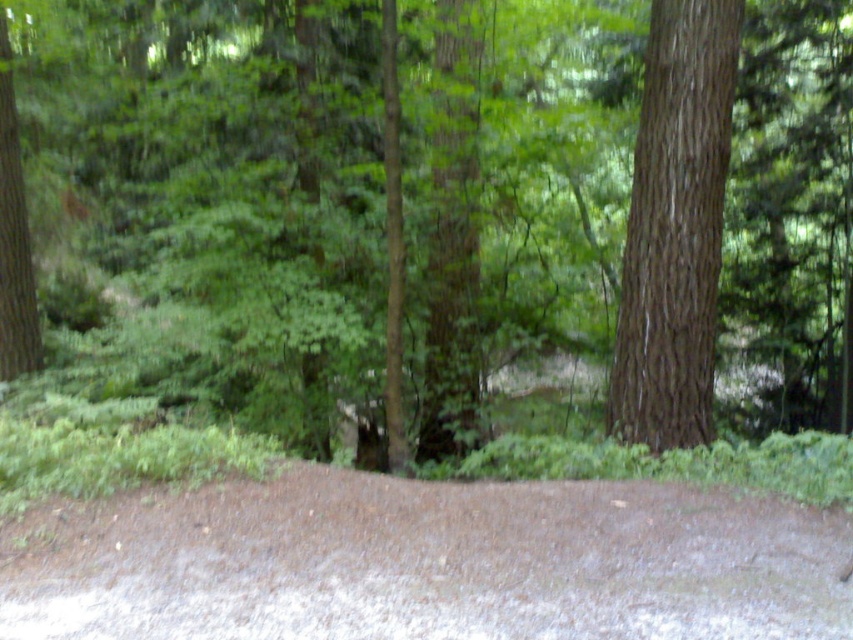
You are planning a hiking trip and want to know if the green leafy forest at center is wider than the brown dirt path at lower center. Can you confirm this based on the scene?

The green leafy forest at center is wider than the brown dirt path at lower center according to the description.

You are a photographer standing in the forest scene. You want to take a photo that includes both the point at coordinates point (x=177, y=515) and point (x=650, y=317). Which point should you focus on to ensure both are in sharp focus?

You should focus on point (x=650, y=317) because it is farther away from the camera than point (x=177, y=515). By focusing on the farther point, the depth of field will include the closer point as well, ensuring both are in sharp focus.

You are standing in the forest scene described. You notice a specific point in the image labeled as point (616,220). Based on the description, what does this point most likely represent?

The point (616,220) indicates the green leafy forest at center.